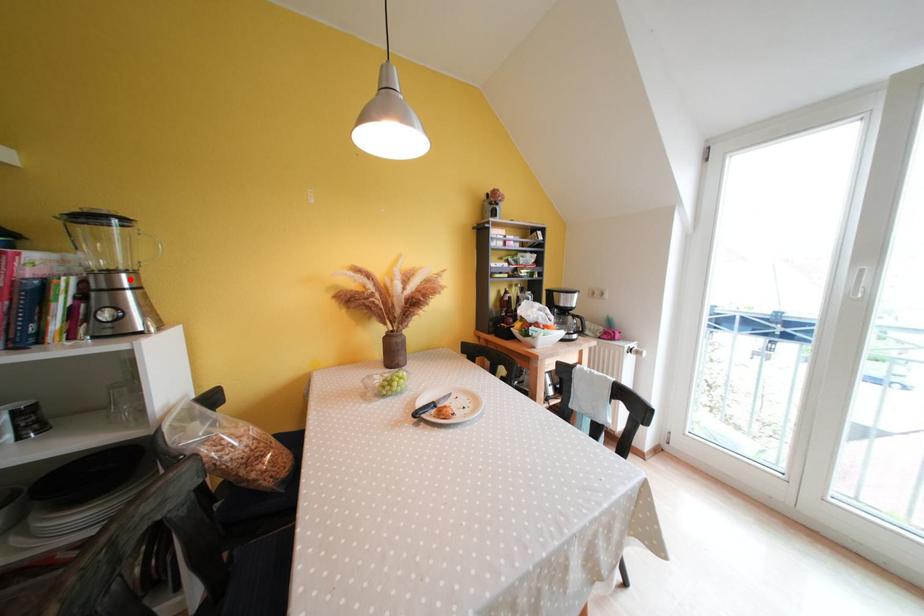
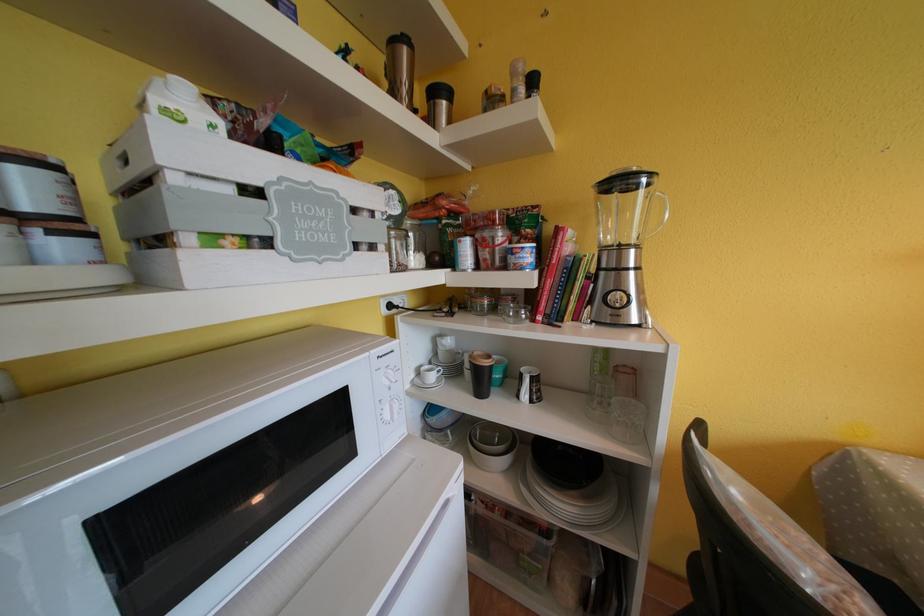
Where in the second image is the point corresponding to the highlighted location from the first image?

(638, 254)